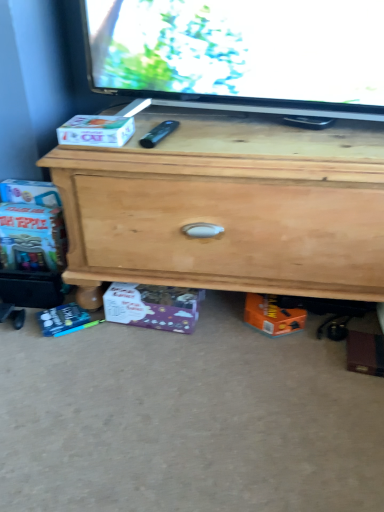
Question: Is purple cardboard box at lower center, positioned as the 1th box in bottom-to-top order, to the left of natural wood chest of drawers at center from the viewer's perspective?

Choices:
 (A) yes
 (B) no

Answer: (A)

Question: Does purple cardboard box at lower center, the 2th box from the front, have a larger size compared to natural wood chest of drawers at center?

Choices:
 (A) no
 (B) yes

Answer: (A)

Question: Is purple cardboard box at lower center, the 2th box from the front, outside natural wood chest of drawers at center?

Choices:
 (A) yes
 (B) no

Answer: (B)

Question: Are purple cardboard box at lower center, positioned as the 1th box in bottom-to-top order, and natural wood chest of drawers at center far apart?

Choices:
 (A) yes
 (B) no

Answer: (B)

Question: Is purple cardboard box at lower center, acting as the first box starting from the back, closer to the viewer compared to natural wood chest of drawers at center?

Choices:
 (A) yes
 (B) no

Answer: (B)

Question: In the image, is white cardboard box at left, the 1th box in the top-to-bottom sequence, on the left side or the right side of purple cardboard box at lower center, the 2th box from the front?

Choices:
 (A) right
 (B) left

Answer: (B)

Question: Considering their positions, is white cardboard box at left, positioned as the 2th box in bottom-to-top order, located in front of or behind purple cardboard box at lower center, acting as the first box starting from the back?

Choices:
 (A) front
 (B) behind

Answer: (A)

Question: In terms of width, does white cardboard box at left, positioned as the 2th box in bottom-to-top order, look wider or thinner when compared to purple cardboard box at lower center, positioned as the 2th box in top-to-bottom order?

Choices:
 (A) thin
 (B) wide

Answer: (B)

Question: Is white cardboard box at left, positioned as the 2th box in bottom-to-top order, taller or shorter than purple cardboard box at lower center, positioned as the 2th box in top-to-bottom order?

Choices:
 (A) short
 (B) tall

Answer: (A)

Question: Is white cardboard box at left, which is the 1th box from front to back, wider or thinner than natural wood chest of drawers at center?

Choices:
 (A) wide
 (B) thin

Answer: (B)

Question: Considering the relative positions of white cardboard box at left, positioned as the 2th box in bottom-to-top order, and natural wood chest of drawers at center in the image provided, is white cardboard box at left, positioned as the 2th box in bottom-to-top order, to the left or to the right of natural wood chest of drawers at center?

Choices:
 (A) right
 (B) left

Answer: (B)

Question: Looking at the image, does white cardboard box at left, which is the 1th box from front to back, seem bigger or smaller compared to natural wood chest of drawers at center?

Choices:
 (A) small
 (B) big

Answer: (A)

Question: In the image, is white cardboard box at left, the 1th box in the top-to-bottom sequence, positioned in front of or behind natural wood chest of drawers at center?

Choices:
 (A) behind
 (B) front

Answer: (A)

Question: Is purple cardboard box at lower center, positioned as the 1th box in bottom-to-top order, wider or thinner than natural wood chest of drawers at center?

Choices:
 (A) thin
 (B) wide

Answer: (A)

Question: From a real-world perspective, is purple cardboard box at lower center, positioned as the 2th box in top-to-bottom order, above or below natural wood chest of drawers at center?

Choices:
 (A) above
 (B) below

Answer: (B)